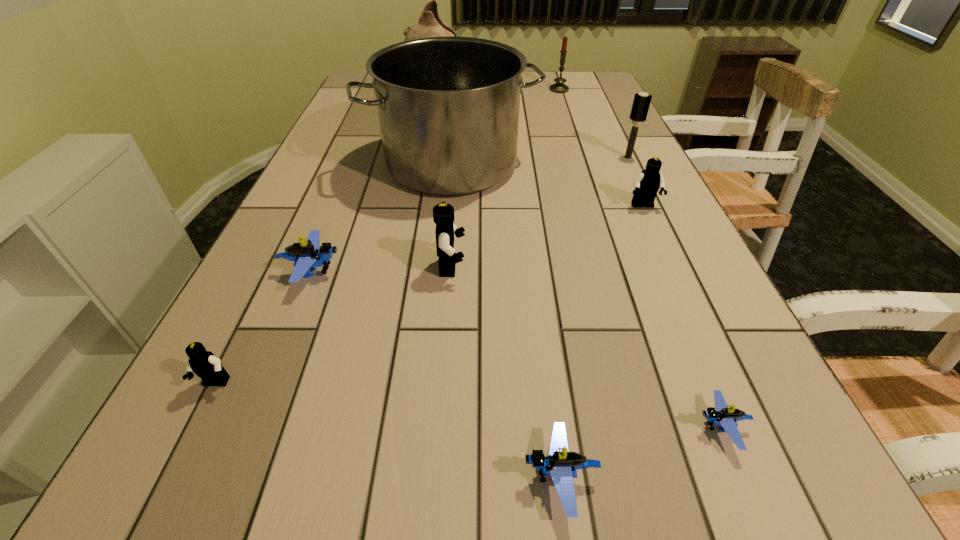
Find the location of a particular element. Image resolution: width=960 pixels, height=540 pixels. object identified as the seventh closest to the nearest black Lego is located at coordinates (641, 103).

The height and width of the screenshot is (540, 960). Identify the location of Lego identified as the second closest to the fourth farthest Lego. (443, 213).

Locate an element on the screen. The width and height of the screenshot is (960, 540). Lego that stands as the fifth closest to the seventh object from left to right is located at coordinates (562, 465).

Identify which black Lego is the closest to the second blue Lego from right to left. Please provide its 2D coordinates. Your answer should be formatted as a tuple, i.e. [(x, y)], where the tuple contains the x and y coordinates of a point satisfying the conditions above.

[(443, 213)]

Locate an element on the screen. black Lego that stands as the closest to the saucepan is located at coordinates (443, 213).

Select which blue Lego is the second closest to the pottery. Please provide its 2D coordinates. Your answer should be formatted as a tuple, i.e. [(x, y)], where the tuple contains the x and y coordinates of a point satisfying the conditions above.

[(720, 415)]

I want to click on blue Lego that stands as the third closest to the second biggest black Lego, so click(x=308, y=255).

Where is `free location that satisfies the following two spatial constraints: 1. on the front-facing side of the second biggest black Lego; 2. on the front-facing side of the second black Lego from right to left`? This screenshot has height=540, width=960. free location that satisfies the following two spatial constraints: 1. on the front-facing side of the second biggest black Lego; 2. on the front-facing side of the second black Lego from right to left is located at coordinates (671, 267).

Locate an element on the screen. This screenshot has height=540, width=960. free space that satisfies the following two spatial constraints: 1. from the spout of the pottery; 2. on the back side of the seventh object from left to right is located at coordinates coord(435,90).

Locate an element on the screen. The height and width of the screenshot is (540, 960). vacant region that satisfies the following two spatial constraints: 1. from the spout of the pottery; 2. on the front-facing side of the smallest black Lego is located at coordinates (378, 384).